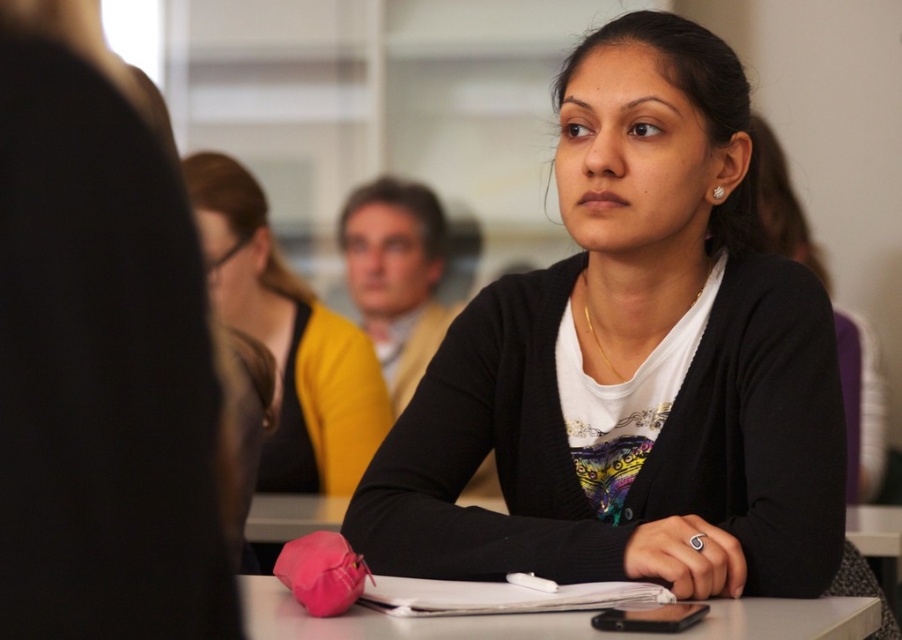
You are a fashion designer observing a model wearing both the black matte cardigan at center and the matte yellow sweater at center. Which item of clothing is larger in size?

The black matte cardigan at center is bigger than the matte yellow sweater at center.

You are organizing a classroom and need to place the matte yellow sweater at center and the white paper at center on a shelf. If the shelf has limited space, which item should you place first to ensure both fit?

The white paper at center should be placed first since the matte yellow sweater at center is bigger and might require more space to accommodate both items.